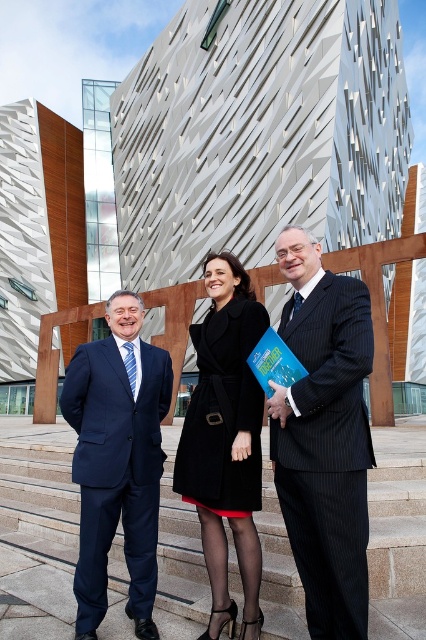
You are standing on the smooth stone stairs at center and want to move to the black wool coat at center. In which direction should you move?

You should move to the right because the smooth stone stairs at center are to the left of the black wool coat at center.

You are standing at the entrance of the building and want to locate the matte black coat at center. According to the coordinates provided, in which direction should you look relative to your position?

The matte black coat at center is located at coordinates point (325, 436). Since the coordinate system is not specified, it is recommended to look towards the central area of the image where the person is standing.

You are a photographer standing at the base of the stone steps where the three individuals are positioned. You want to capture a portrait of the matte black coat at center while ensuring the entire structure behind them is visible in the background. Given the distance between the photographer and the coat, will you need to use a wide angle lens or a telephoto lens?

→ The photographer is 5.22 meters away from the matte black coat at center. Since the photographer needs to include the entire structure in the background while focusing on the coat, a telephoto lens would be necessary to compress the background and keep the subject in focus at that distance.